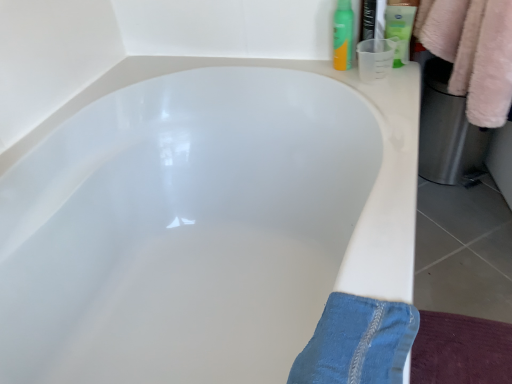
Question: Considering their positions, is white glossy bathtub at center located in front of or behind denim at lower right?

Choices:
 (A) front
 (B) behind

Answer: (B)

Question: From a real-world perspective, relative to denim at lower right, is white glossy bathtub at center vertically above or below?

Choices:
 (A) above
 (B) below

Answer: (B)

Question: Estimate the real-world distances between objects in this image. Which object is farther from the green matte lotion at upper right, acting as the second toiletry starting from the left?

Choices:
 (A) green matte spray can at upper right, marked as the first toiletry in a left-to-right arrangement
 (B) white glossy bathtub at center
 (C) denim at lower right

Answer: (C)

Question: Which is nearer to the green matte lotion at upper right, acting as the second toiletry starting from the left?

Choices:
 (A) white glossy bathtub at center
 (B) denim at lower right
 (C) green matte spray can at upper right, marked as the second toiletry in a right-to-left arrangement

Answer: (C)